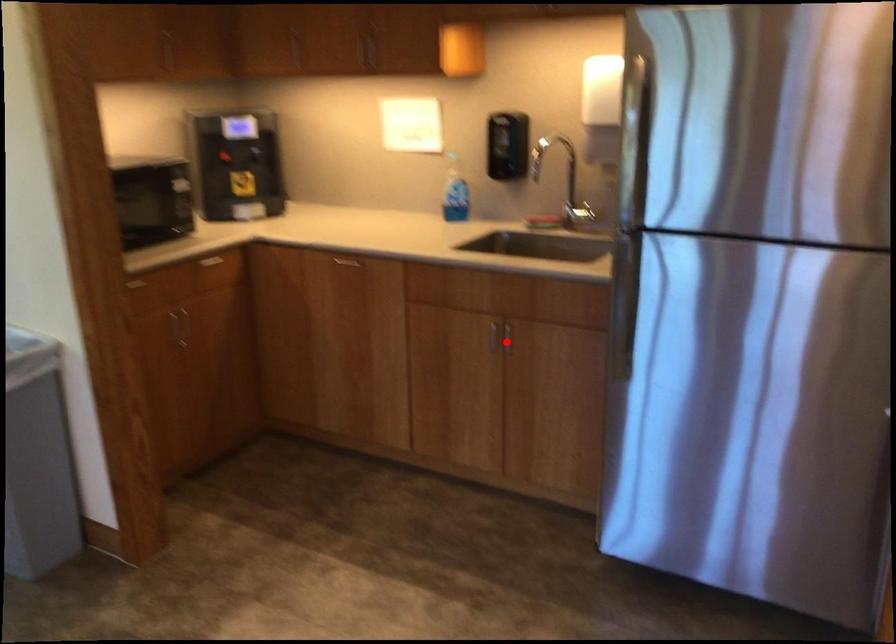
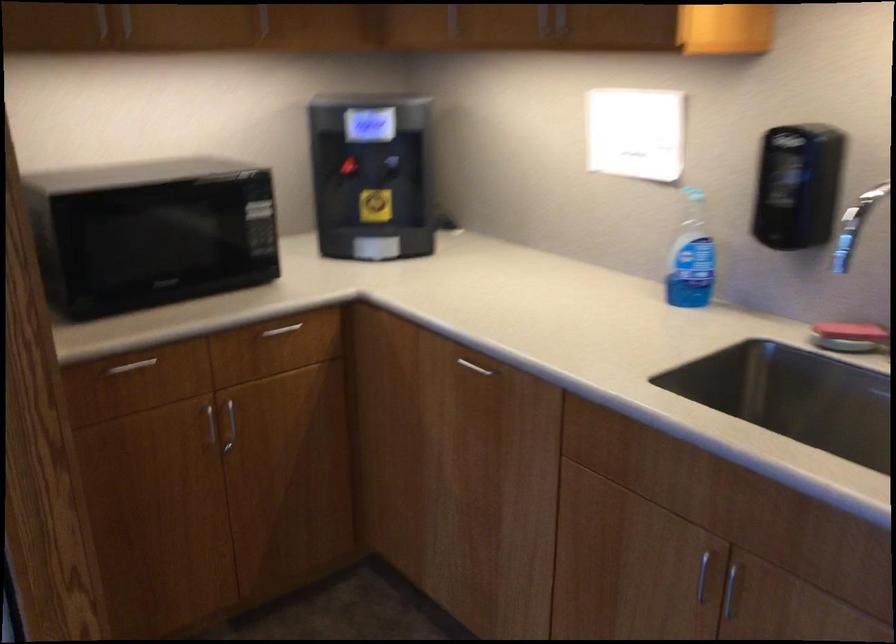
Find the pixel in the second image that matches the highlighted location in the first image.

(729, 590)